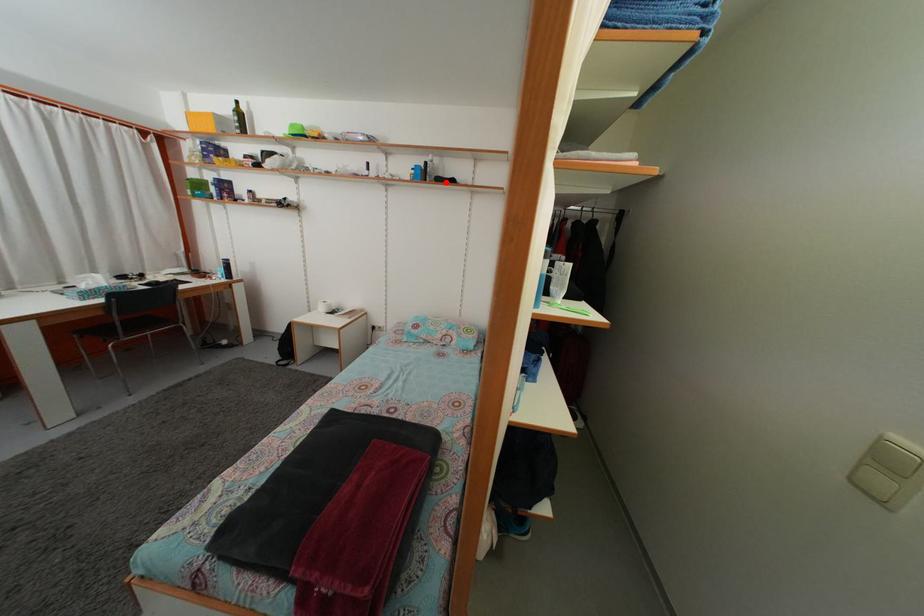
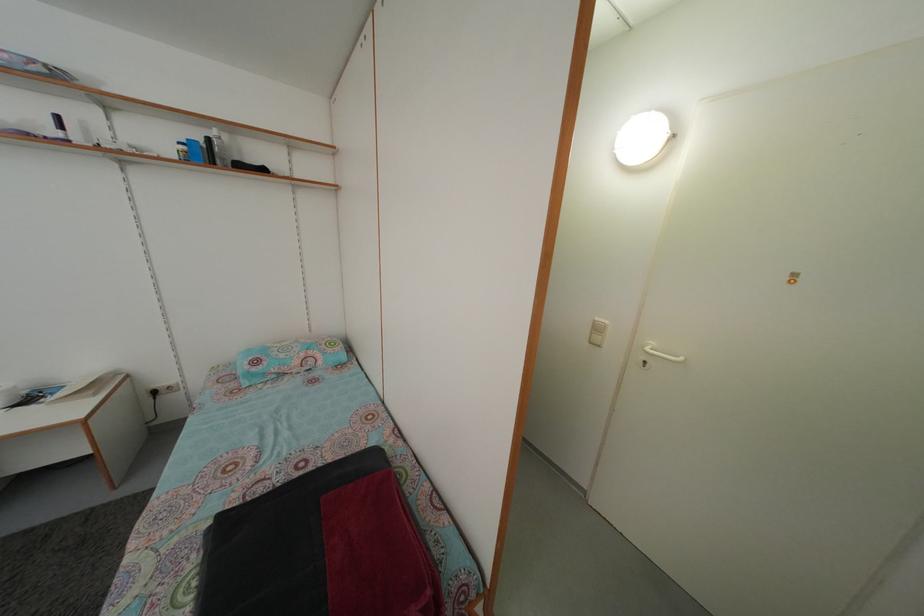
Question: I am providing you with two images of the same scene from different viewpoints. Image1 has a red point marked. In image2, the corresponding 3D location appears at what relative position? Reply with the corresponding letter.

Choices:
 (A) Closer
 (B) Farther

Answer: (B)